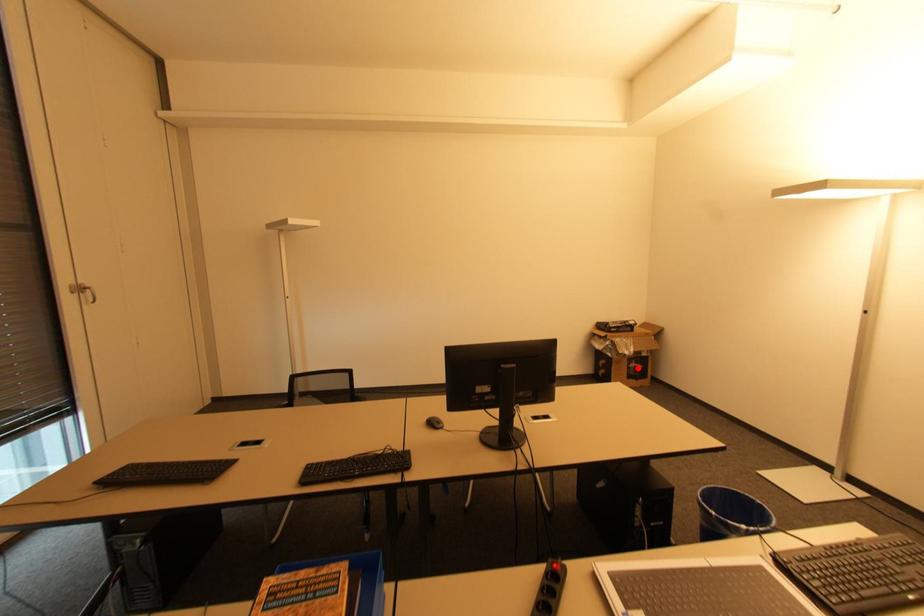
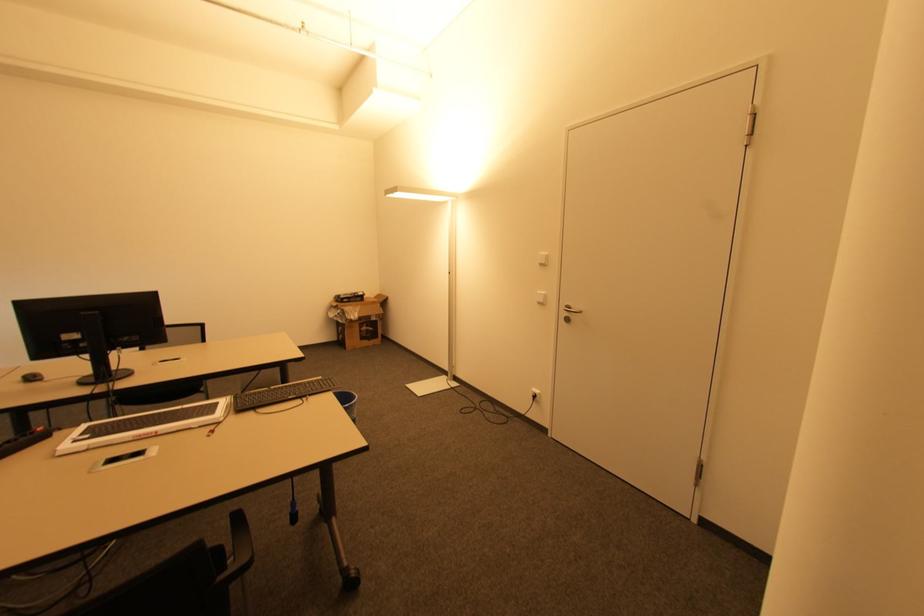
Question: I am providing you with two images of the same scene from different viewpoints. In image1, a red point is highlighted. Considering the same 3D point in image2, which of the following is correct?

Choices:
 (A) It is closer
 (B) It is farther

Answer: (A)